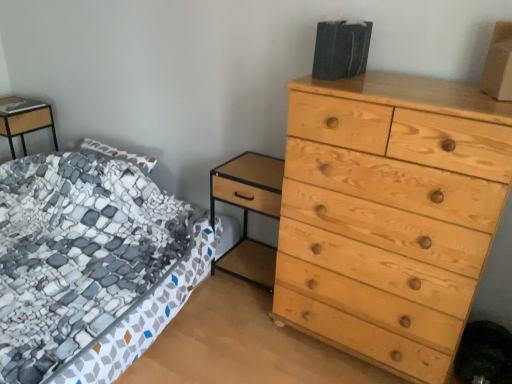
You are a GUI agent. You are given a task and a screenshot of the screen. Output one action in this format:
    pyautogui.click(x=<x>, y=<y>)
    Task: Click on the vacant area on top of light wood/texture nightstand at center, the 2th nightstand viewed from the back (from a real-world perspective)
    This screenshot has height=384, width=512.
    Given the screenshot: What is the action you would take?
    pyautogui.click(x=267, y=168)